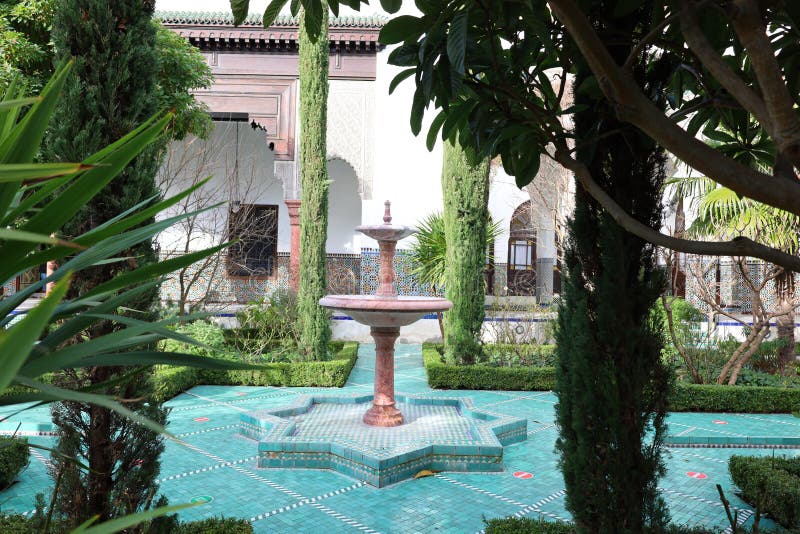
You are a GUI agent. You are given a task and a screenshot of the screen. Output one action in this format:
    pyautogui.click(x=<x>, y=<y>)
    Task: Click on the tiles
    Image resolution: width=800 pixels, height=534 pixels.
    Given the screenshot: What is the action you would take?
    pyautogui.click(x=276, y=516), pyautogui.click(x=200, y=433), pyautogui.click(x=406, y=359), pyautogui.click(x=726, y=436), pyautogui.click(x=548, y=458), pyautogui.click(x=434, y=416), pyautogui.click(x=334, y=417)